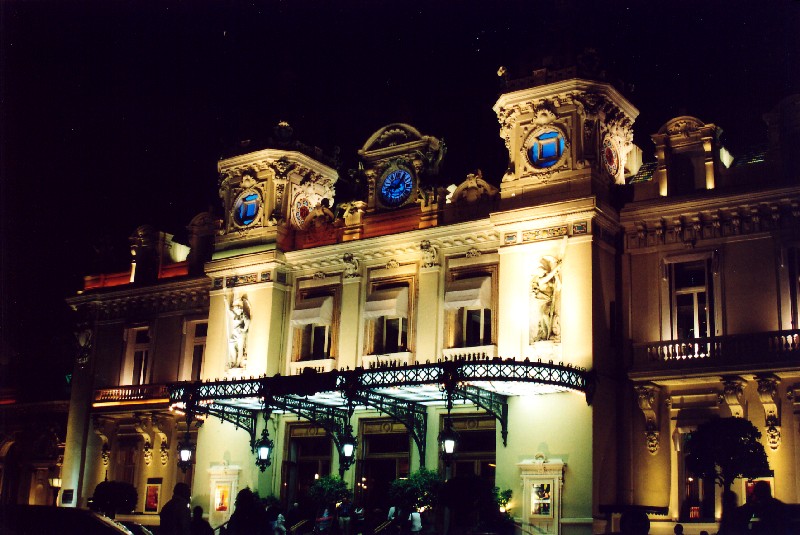
You are a GUI agent. You are given a task and a screenshot of the screen. Output one action in this format:
    pyautogui.click(x=<x>, y=<y>)
    Task: Click on the doorway
    This screenshot has width=800, height=535.
    Given the screenshot: What is the action you would take?
    pyautogui.click(x=482, y=455), pyautogui.click(x=384, y=447), pyautogui.click(x=306, y=452)